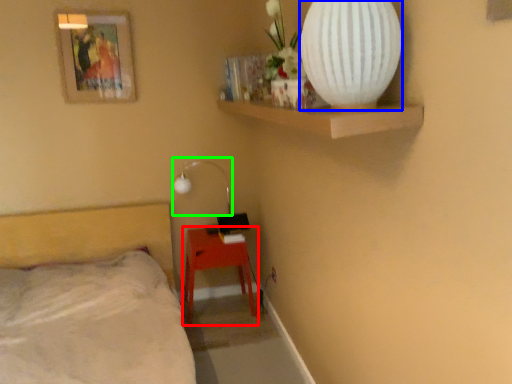
Question: Considering the real-world distances, which object is closest to nightstand (highlighted by a red box)? vase (highlighted by a blue box) or lamp (highlighted by a green box).

Choices:
 (A) vase
 (B) lamp

Answer: (B)